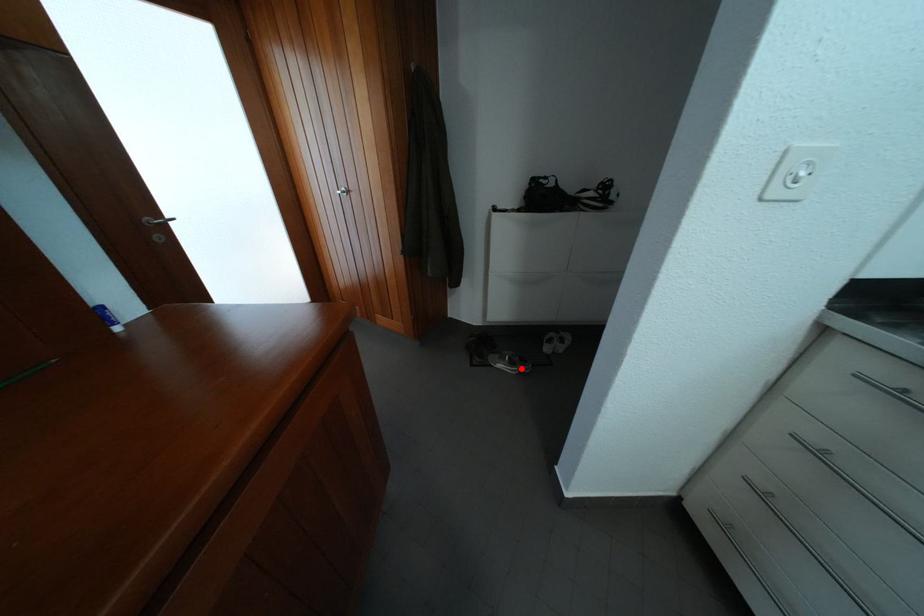
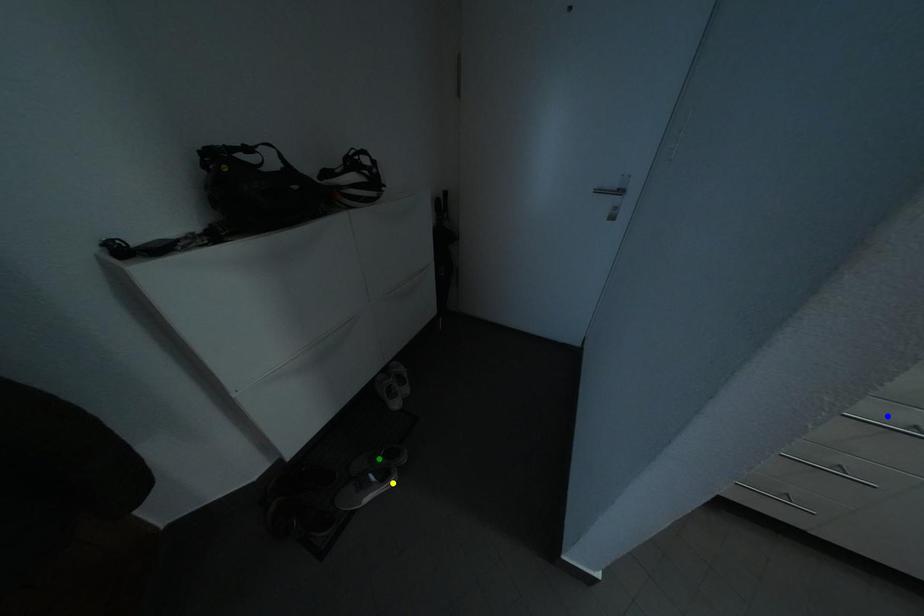
Question: I am providing you with two images of the same scene from different viewpoints. A red point is marked on the first image. You are given multiple points on the second image. Which point in image 2 is actually the same real-world point as the red point in image 1?

Choices:
 (A) yellow point
 (B) green point
 (C) blue point

Answer: (A)